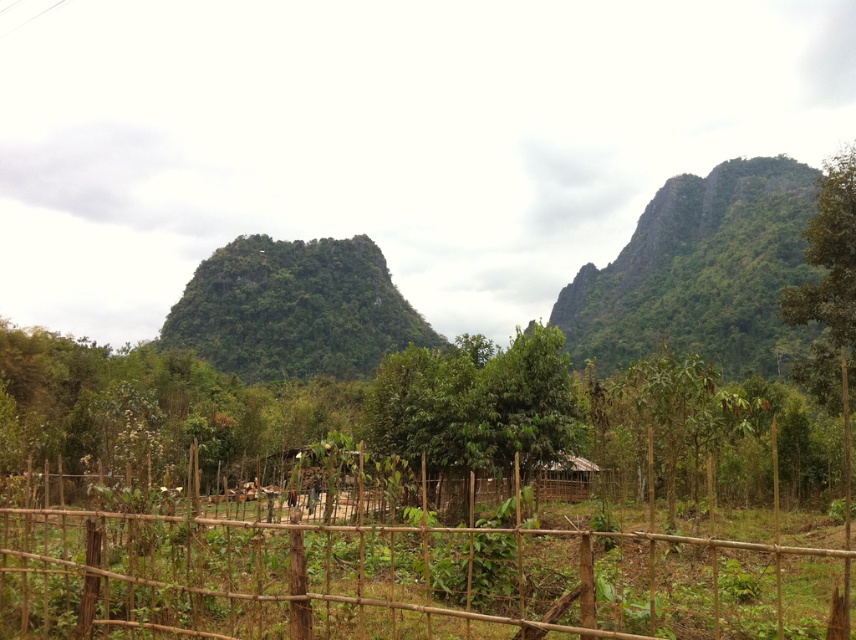
Does bamboo fence at center appear under green leafy mountain at upper right?

Yes, bamboo fence at center is below green leafy mountain at upper right.

This screenshot has width=856, height=640. What do you see at coordinates (402, 570) in the screenshot?
I see `bamboo fence at center` at bounding box center [402, 570].

The image size is (856, 640). Find the location of `bamboo fence at center`. bamboo fence at center is located at coordinates (402, 570).

Between green leafy mountain at upper right and brown wooden hut at center, which one is positioned higher?

Positioned higher is green leafy mountain at upper right.

Which of these two, green leafy mountain at upper right or brown wooden hut at center, stands shorter?

brown wooden hut at center is shorter.

Locate an element on the screen. green leafy mountain at upper right is located at coordinates (700, 273).

Is bamboo fence at center smaller than brown wooden hut at center?

Actually, bamboo fence at center might be larger than brown wooden hut at center.

Which is in front, point (295, 596) or point (557, 474)?

Point (295, 596) is in front.

Is point (110, 512) positioned after point (539, 467)?

No, (110, 512) is closer to viewer.

The width and height of the screenshot is (856, 640). In order to click on bamboo fence at center in this screenshot , I will do `click(402, 570)`.